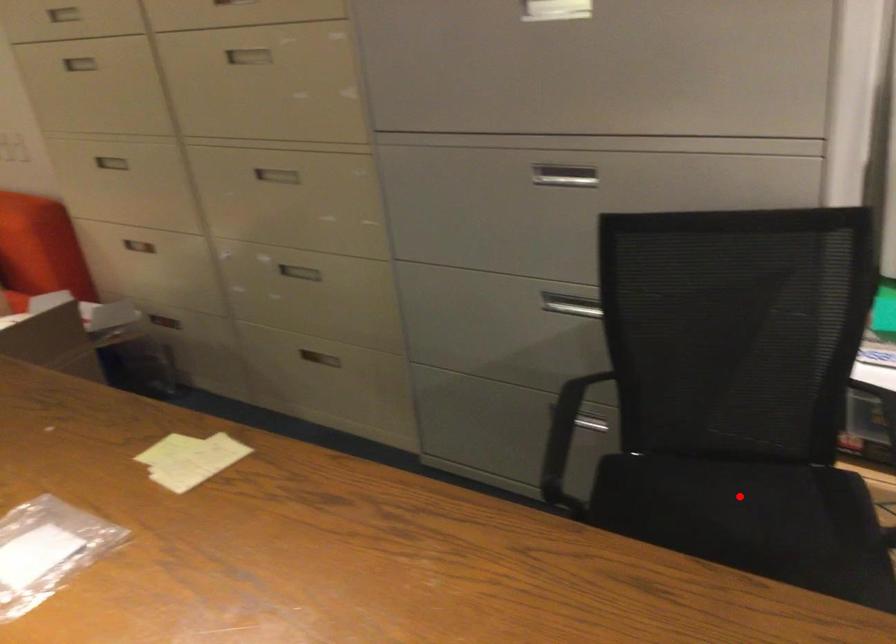
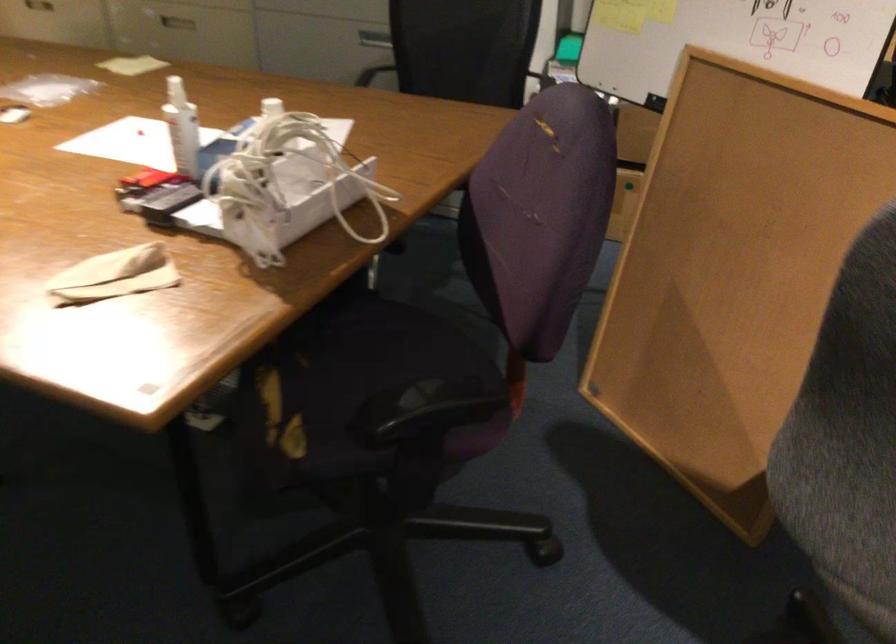
Question: I am providing you with two images of the same scene from different viewpoints. A red point is marked on the first image. Can you still see the location of the red point in image 2?

Choices:
 (A) Yes
 (B) No

Answer: (B)